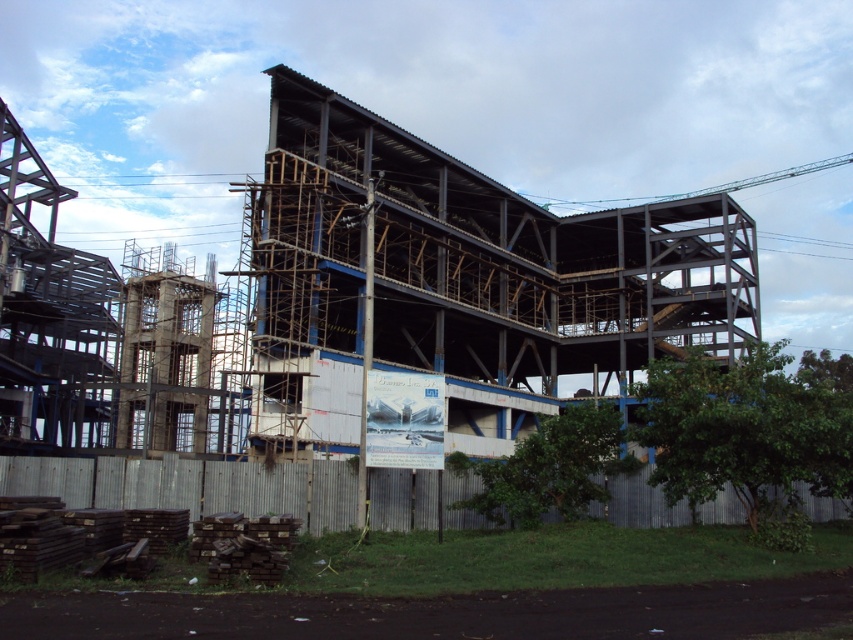
Does metal scaffolding at center appear on the left side of gray corrugated metal fence at lower center?

In fact, metal scaffolding at center is to the right of gray corrugated metal fence at lower center.

Is point (450, 168) positioned behind point (381, 516)?

Yes, point (450, 168) is behind point (381, 516).

Identify the location of metal scaffolding at center. The width and height of the screenshot is (853, 640). (463, 280).